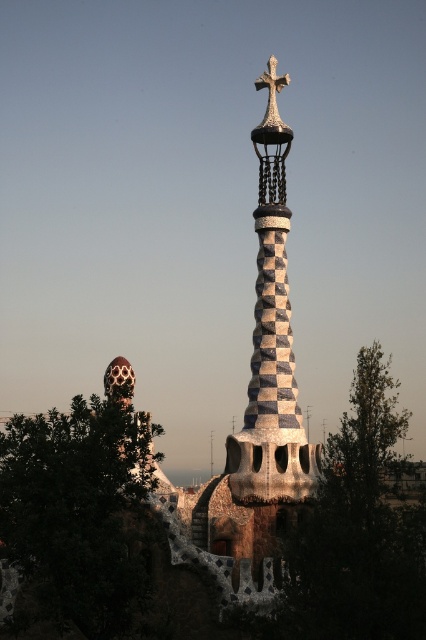
Is point (278, 371) more distant than point (259, 83)?

No, (278, 371) is in front of (259, 83).

Which is below, speckled ceramic spire at center or white stone cross at upper center?

speckled ceramic spire at center is lower down.

Who is more distant from viewer, (264,138) or (279,86)?

The point (279,86) is behind.

Where is `speckled ceramic spire at center`? This screenshot has height=640, width=426. speckled ceramic spire at center is located at coordinates (271, 349).